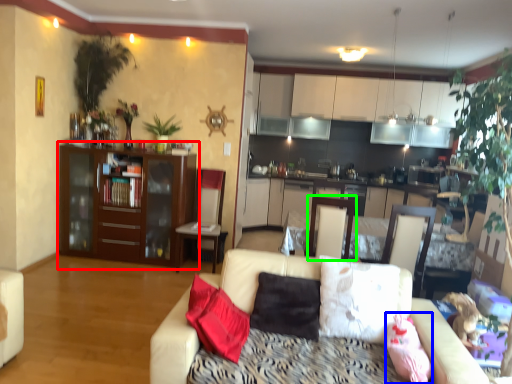
Question: Which object is positioned closest to cabinetry (highlighted by a red box)? Select from pillow (highlighted by a blue box) and swivel chair (highlighted by a green box).

Choices:
 (A) pillow
 (B) swivel chair

Answer: (B)